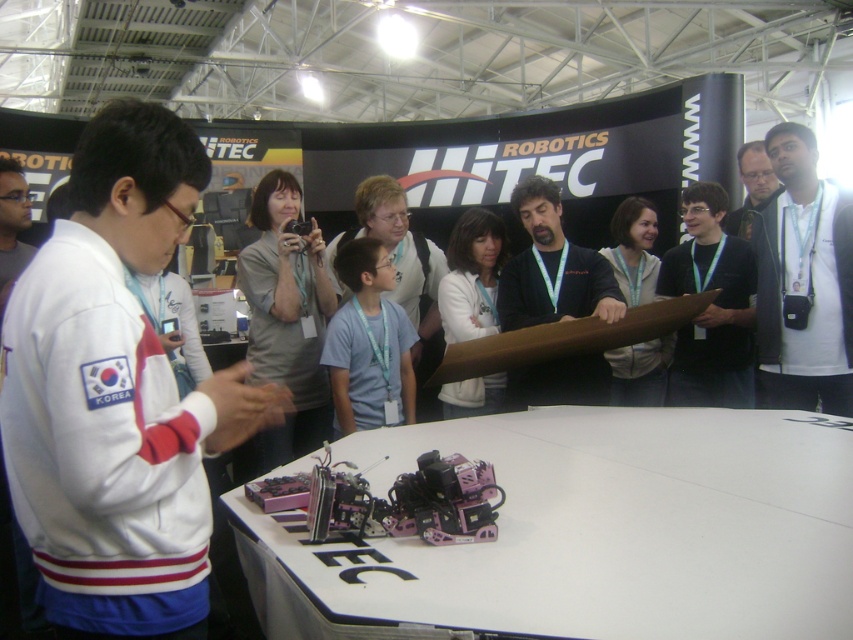
Does point (527, 536) lie in front of point (412, 280)?

Yes, point (527, 536) is closer to viewer.

How much distance is there between white plastic table at center and pink matte robot at center?

The distance of white plastic table at center from pink matte robot at center is 1.31 meters.

Who is more forward, (x=525, y=472) or (x=399, y=196)?

Point (x=525, y=472) is more forward.

I want to click on white plastic table at center, so click(x=593, y=531).

Which is more to the right, light brown leather jacket at center or matte black shirt at upper right?

From the viewer's perspective, matte black shirt at upper right appears more on the right side.

Does light brown leather jacket at center have a smaller size compared to matte black shirt at upper right?

Yes.

Where is `light brown leather jacket at center`? The image size is (853, 640). light brown leather jacket at center is located at coordinates (634, 250).

Between white plastic table at center and white matte jacket at center, which one is positioned higher?

Positioned higher is white matte jacket at center.

Is point (376, 604) farther from camera compared to point (454, 298)?

No, (376, 604) is closer to viewer.

Does point (697, 595) lie in front of point (454, 305)?

Yes, it is.

Where is `white plastic table at center`? The height and width of the screenshot is (640, 853). white plastic table at center is located at coordinates (593, 531).